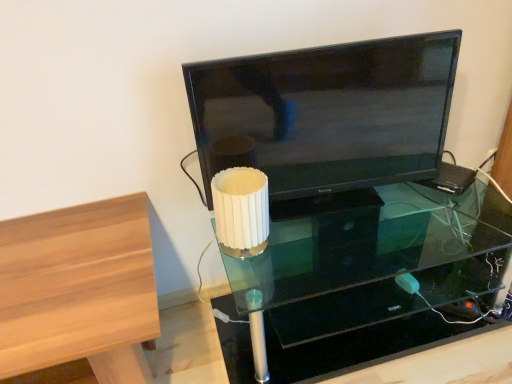
Question: From the image's perspective, relative to matte black tv at center, is transparent glass table at center above or below?

Choices:
 (A) above
 (B) below

Answer: (B)

Question: From a real-world perspective, relative to matte black tv at center, is transparent glass table at center vertically above or below?

Choices:
 (A) below
 (B) above

Answer: (A)

Question: Which object is positioned closest to the light brown wood table at left?

Choices:
 (A) white ribbed plastic at center
 (B) transparent glass table at center
 (C) matte black tv at center

Answer: (A)

Question: Which object is the closest to the transparent glass table at center?

Choices:
 (A) matte black tv at center
 (B) white ribbed plastic at center
 (C) light brown wood table at left

Answer: (A)